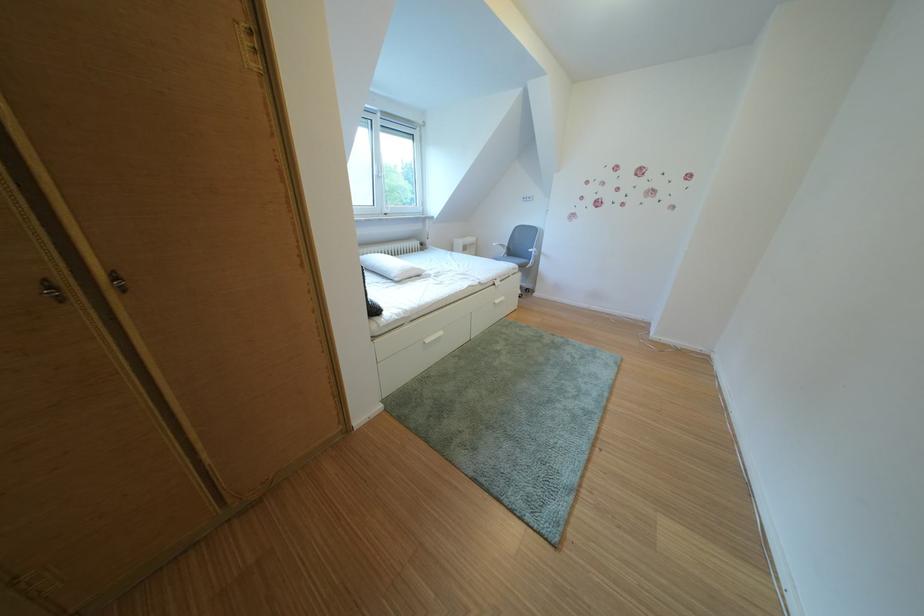
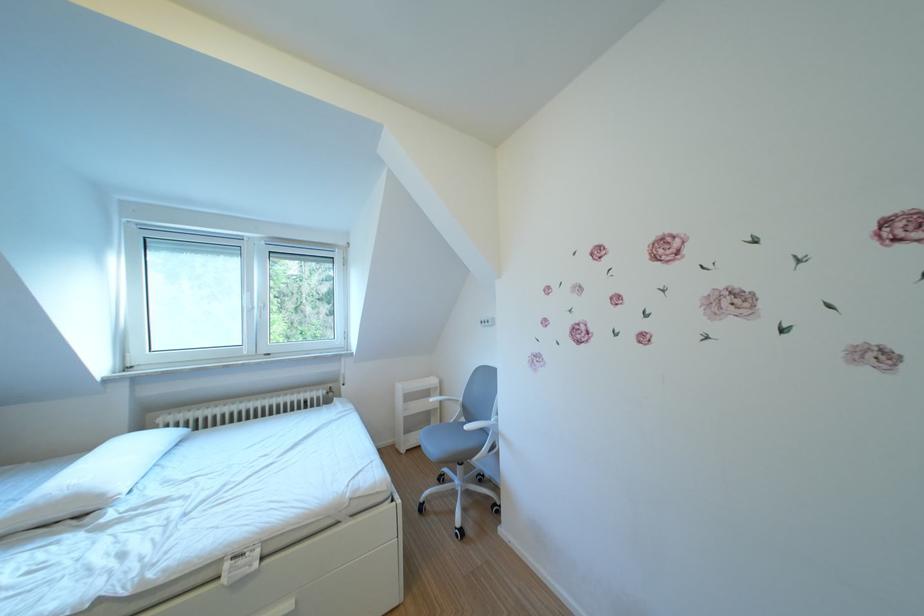
Find the pixel in the second image that matches (433,275) in the first image.

(115, 501)